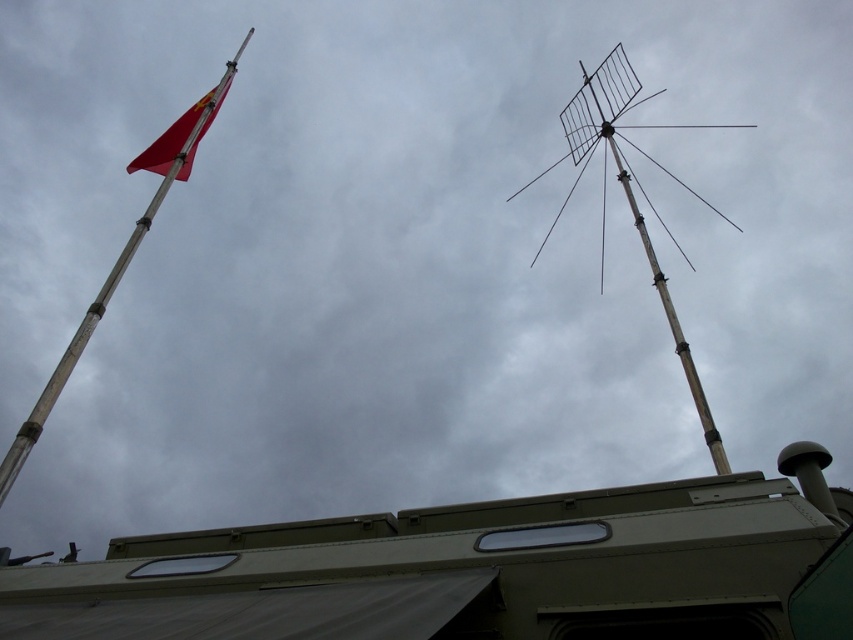
Question: Can you confirm if matte green recreational vehicle at lower center is smaller than red matte flag at upper left?

Choices:
 (A) yes
 (B) no

Answer: (A)

Question: Which point is farther to the camera?

Choices:
 (A) metallic flag pole at left
 (B) metallic antenna at upper right
 (C) red matte flag at upper left
 (D) matte green recreational vehicle at lower center

Answer: (C)

Question: Which point appears farthest from the camera in this image?

Choices:
 (A) (730, 552)
 (B) (181, 134)

Answer: (B)

Question: Among these points, which one is farthest from the camera?

Choices:
 (A) (535, 180)
 (B) (22, 445)
 (C) (434, 572)
 (D) (196, 106)

Answer: (A)

Question: Does metallic antenna at upper right have a greater width compared to metallic flag pole at left?

Choices:
 (A) yes
 (B) no

Answer: (A)

Question: Is metallic flag pole at left above red matte flag at upper left?

Choices:
 (A) yes
 (B) no

Answer: (B)